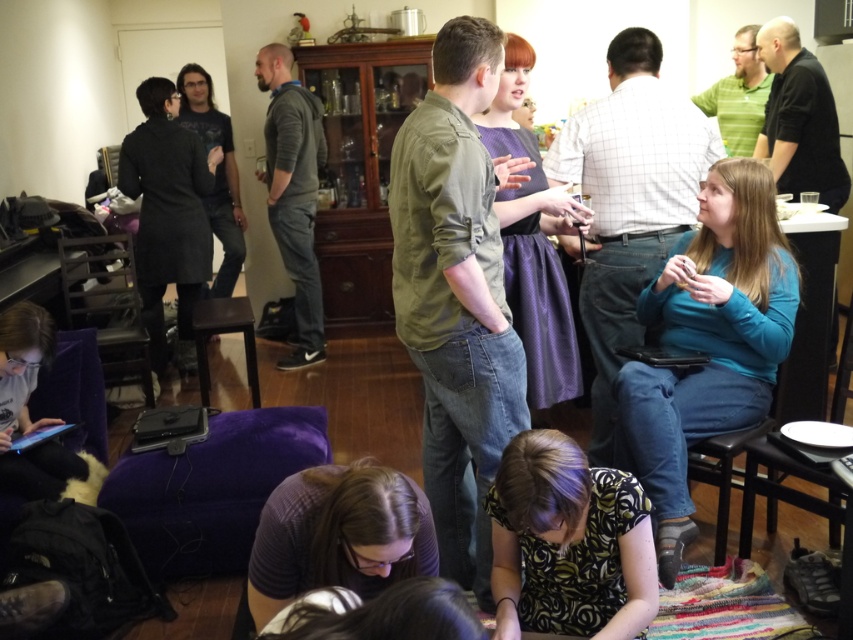
Can you confirm if green cotton shirt at center is bigger than blue fabric chair at center?

Correct, green cotton shirt at center is larger in size than blue fabric chair at center.

Which is below, green cotton shirt at center or blue fabric chair at center?

green cotton shirt at center is lower down.

The width and height of the screenshot is (853, 640). Find the location of `green cotton shirt at center`. green cotton shirt at center is located at coordinates (456, 294).

Does point (581, 632) come farther from viewer compared to point (773, 419)?

No, it is in front of (773, 419).

Is point (517, 500) closer to camera compared to point (715, 445)?

Yes, it is in front of point (715, 445).

The width and height of the screenshot is (853, 640). Describe the element at coordinates (567, 541) in the screenshot. I see `printed fabric shirt at lower center` at that location.

Image resolution: width=853 pixels, height=640 pixels. What are the coordinates of `printed fabric shirt at lower center` in the screenshot? It's located at (567, 541).

Does blue fabric chair at center have a greater width compared to green matte shirt at upper right?

Indeed, blue fabric chair at center has a greater width compared to green matte shirt at upper right.

The image size is (853, 640). Find the location of `blue fabric chair at center`. blue fabric chair at center is located at coordinates (630, 200).